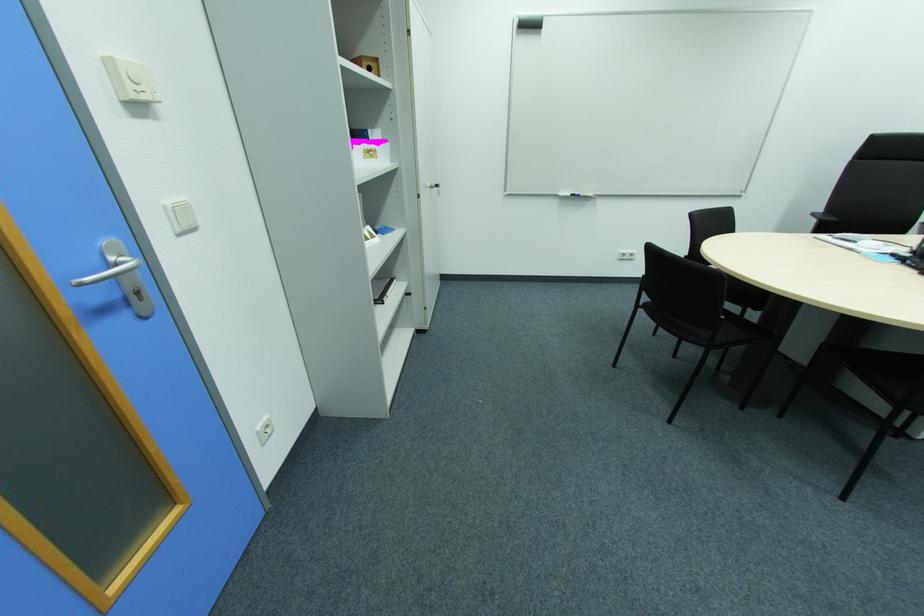
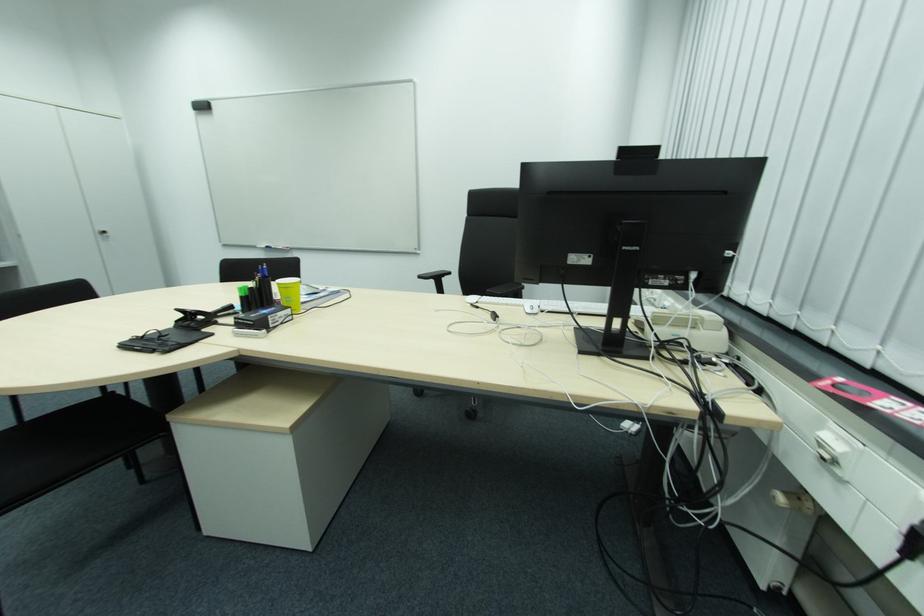
Question: What movement of the cameraman would produce the second image?

Choices:
 (A) Left
 (B) Right
 (C) Forward
 (D) Backward

Answer: (B)